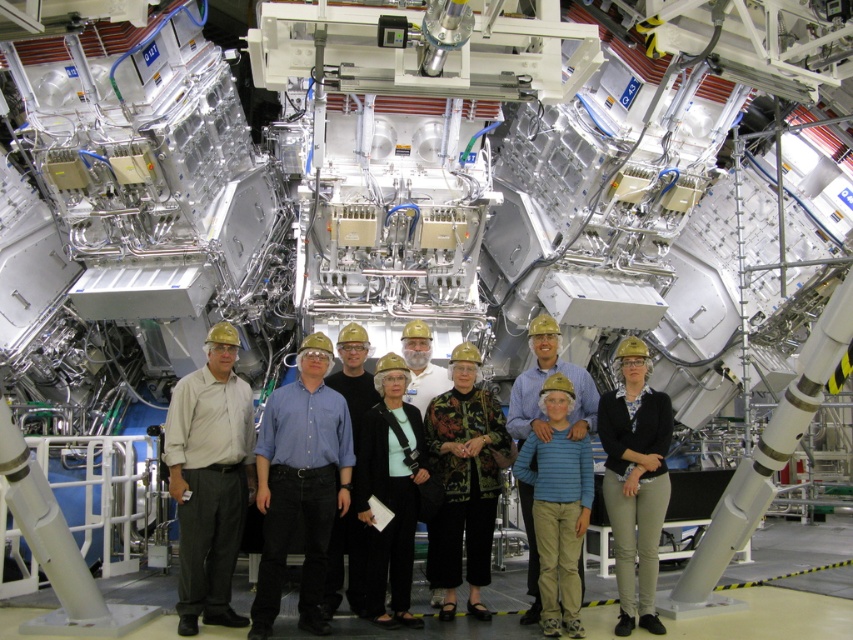
Question: In this image, where is black fabric jacket at center located relative to black hard hat at center?

Choices:
 (A) right
 (B) left

Answer: (B)

Question: Where is light beige fabric shirt at center located in relation to black fabric jacket at center in the image?

Choices:
 (A) below
 (B) above

Answer: (A)

Question: Can you confirm if light beige fabric shirt at center is positioned to the left of floral-patterned sweater at center?

Choices:
 (A) no
 (B) yes

Answer: (B)

Question: Among these points, which one is nearest to the camera?

Choices:
 (A) (368, 445)
 (B) (558, 483)

Answer: (B)

Question: Which object is farther from the camera taking this photo?

Choices:
 (A) black matte jacket at center
 (B) black fabric jacket at center
 (C) blue striped shirt at center
 (D) floral-patterned sweater at center

Answer: (D)

Question: Which point is closer to the camera taking this photo?

Choices:
 (A) (482, 572)
 (B) (567, 444)
 (C) (607, 451)
 (D) (218, 577)

Answer: (D)